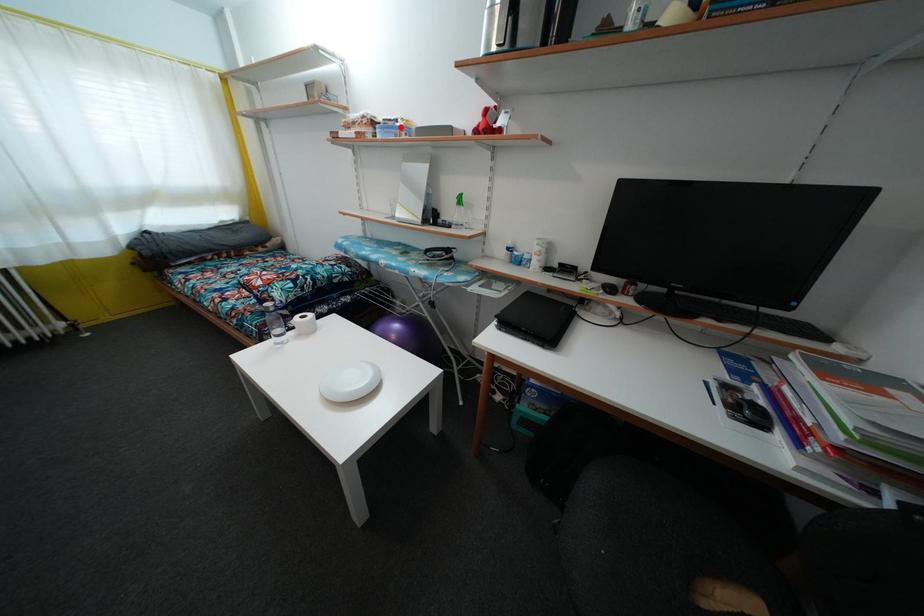
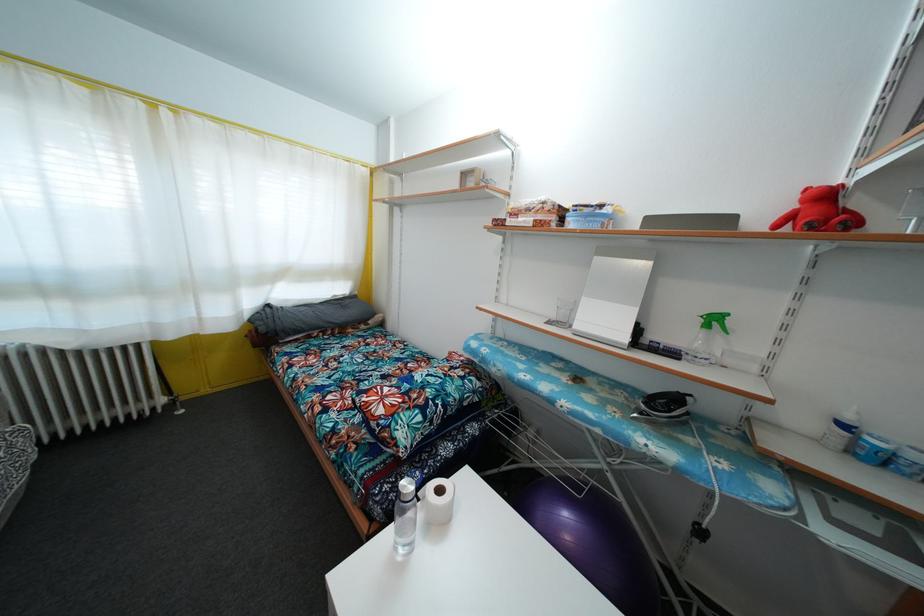
Locate, in the second image, the point that corresponds to the highlighted location in the first image.

(605, 213)